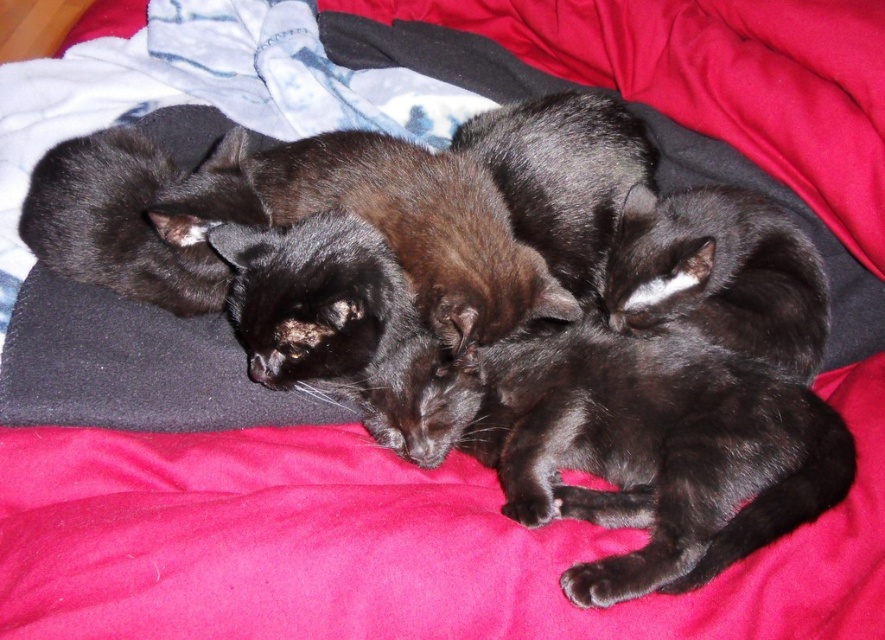
Is black silky fur cat at lower right to the right of shiny black cat at center from the viewer's perspective?

Indeed, black silky fur cat at lower right is positioned on the right side of shiny black cat at center.

Does black silky fur cat at lower right have a greater width compared to shiny black cat at center?

Indeed, black silky fur cat at lower right has a greater width compared to shiny black cat at center.

Based on the photo, who is more distant from viewer, (580, 342) or (336, 305)?

Point (580, 342)

In order to click on black silky fur cat at lower right in this screenshot , I will do click(x=655, y=451).

Does black silky fur cat at lower right have a lesser height compared to black fur cat at center?

No, black silky fur cat at lower right is not shorter than black fur cat at center.

Which of these two, black silky fur cat at lower right or black fur cat at center, stands taller?

With more height is black silky fur cat at lower right.

I want to click on black silky fur cat at lower right, so click(x=655, y=451).

Identify the location of black silky fur cat at lower right. This screenshot has width=885, height=640. tap(655, 451).

Based on the photo, can you confirm if shiny black cat at center is positioned to the left of black fur cat at center?

In fact, shiny black cat at center is to the right of black fur cat at center.

Who is positioned more to the right, shiny black cat at center or black fur cat at center?

From the viewer's perspective, shiny black cat at center appears more on the right side.

This screenshot has height=640, width=885. What do you see at coordinates (345, 330) in the screenshot? I see `shiny black cat at center` at bounding box center [345, 330].

I want to click on shiny black cat at center, so click(x=345, y=330).